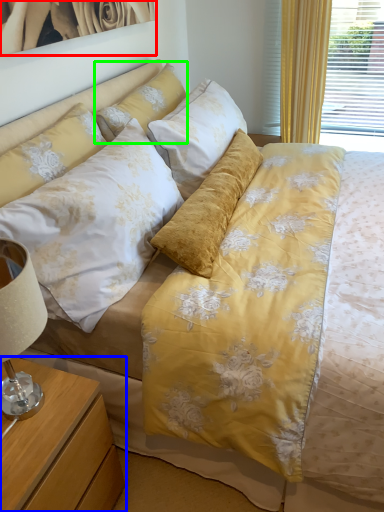
Question: Estimate the real-world distances between objects in this image. Which object is farther from picture frame (highlighted by a red box), nightstand (highlighted by a blue box) or pillow (highlighted by a green box)?

Choices:
 (A) nightstand
 (B) pillow

Answer: (A)